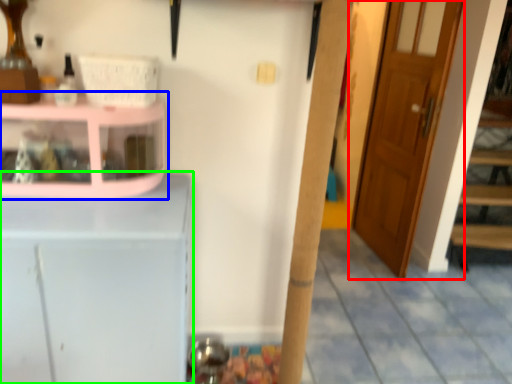
Question: Estimate the real-world distances between objects in this image. Which object is farther from door (highlighted by a red box), shelf (highlighted by a blue box) or cabinetry (highlighted by a green box)?

Choices:
 (A) shelf
 (B) cabinetry

Answer: (B)